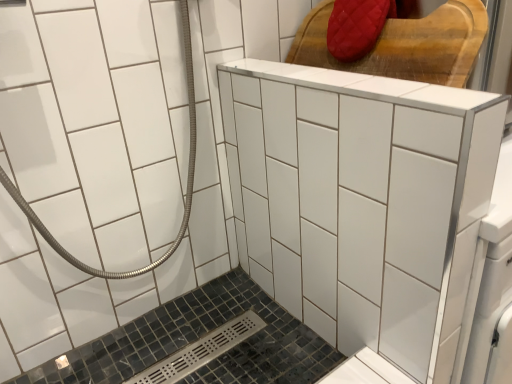
Question: Is white glossy ceramic tile at center far away from black mosaic tile bath at lower left?

Choices:
 (A) yes
 (B) no

Answer: (B)

Question: Considering the relative sizes of white glossy ceramic tile at center and black mosaic tile bath at lower left in the image provided, is white glossy ceramic tile at center thinner than black mosaic tile bath at lower left?

Choices:
 (A) yes
 (B) no

Answer: (A)

Question: Is the position of white glossy ceramic tile at center more distant than that of black mosaic tile bath at lower left?

Choices:
 (A) no
 (B) yes

Answer: (A)

Question: Would you say white glossy ceramic tile at center contains black mosaic tile bath at lower left?

Choices:
 (A) no
 (B) yes

Answer: (A)

Question: Is white glossy ceramic tile at center looking in the opposite direction of black mosaic tile bath at lower left?

Choices:
 (A) no
 (B) yes

Answer: (A)

Question: Considering the positions of red quilted fabric at upper right and black mosaic tile bath at lower left in the image, is red quilted fabric at upper right wider or thinner than black mosaic tile bath at lower left?

Choices:
 (A) wide
 (B) thin

Answer: (B)

Question: Looking at the image, does red quilted fabric at upper right seem bigger or smaller compared to black mosaic tile bath at lower left?

Choices:
 (A) big
 (B) small

Answer: (B)

Question: Does point (409, 69) appear closer or farther from the camera than point (142, 336)?

Choices:
 (A) farther
 (B) closer

Answer: (B)

Question: From a real-world perspective, is red quilted fabric at upper right above or below black mosaic tile bath at lower left?

Choices:
 (A) above
 (B) below

Answer: (A)

Question: Is white glossy ceramic tile at center taller or shorter than red quilted fabric at upper right?

Choices:
 (A) tall
 (B) short

Answer: (A)

Question: Do you think white glossy ceramic tile at center is within red quilted fabric at upper right, or outside of it?

Choices:
 (A) outside
 (B) inside

Answer: (A)

Question: Considering their positions, is white glossy ceramic tile at center located in front of or behind red quilted fabric at upper right?

Choices:
 (A) behind
 (B) front

Answer: (B)

Question: In terms of width, does white glossy ceramic tile at center look wider or thinner when compared to red quilted fabric at upper right?

Choices:
 (A) thin
 (B) wide

Answer: (A)

Question: Is red quilted fabric at upper right situated inside white glossy ceramic tile at center or outside?

Choices:
 (A) outside
 (B) inside

Answer: (A)

Question: Would you say red quilted fabric at upper right is to the left or to the right of white glossy ceramic tile at center in the picture?

Choices:
 (A) left
 (B) right

Answer: (B)